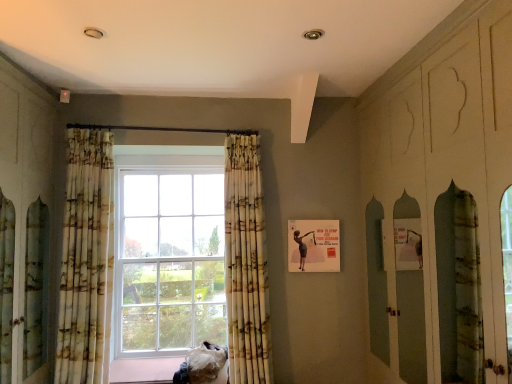
Question: Which direction should I rotate to look at printed fabric curtain at center, marked as the 2th curtain in a left-to-right arrangement?

Choices:
 (A) left
 (B) right

Answer: (A)

Question: Is printed fabric curtain at center, which is the first curtain in right-to-left order, aimed at fuzzy fabric cat at lower center?

Choices:
 (A) yes
 (B) no

Answer: (B)

Question: Is the depth of printed fabric curtain at center, which is the first curtain in right-to-left order, less than that of fuzzy fabric cat at lower center?

Choices:
 (A) yes
 (B) no

Answer: (A)

Question: Is printed fabric curtain at center, which is the first curtain in right-to-left order, not close to fuzzy fabric cat at lower center?

Choices:
 (A) no
 (B) yes

Answer: (A)

Question: From a real-world perspective, is printed fabric curtain at center, marked as the 2th curtain in a left-to-right arrangement, under fuzzy fabric cat at lower center?

Choices:
 (A) yes
 (B) no

Answer: (B)

Question: From a real-world perspective, is printed fabric curtain at center, marked as the 2th curtain in a left-to-right arrangement, over fuzzy fabric cat at lower center?

Choices:
 (A) yes
 (B) no

Answer: (A)

Question: Would you say printed fabric curtain at center, which is the first curtain in right-to-left order, contains fuzzy fabric cat at lower center?

Choices:
 (A) yes
 (B) no

Answer: (B)

Question: From a real-world perspective, is fuzzy fabric cat at lower center located higher than printed fabric curtain at left, the 2th curtain in the right-to-left sequence?

Choices:
 (A) no
 (B) yes

Answer: (A)

Question: Does fuzzy fabric cat at lower center appear on the left side of printed fabric curtain at left, the 2th curtain in the right-to-left sequence?

Choices:
 (A) no
 (B) yes

Answer: (A)

Question: From the image's perspective, is fuzzy fabric cat at lower center located beneath printed fabric curtain at left, which is the first curtain in left-to-right order?

Choices:
 (A) yes
 (B) no

Answer: (A)

Question: Is fuzzy fabric cat at lower center looking in the opposite direction of printed fabric curtain at left, which is the first curtain in left-to-right order?

Choices:
 (A) yes
 (B) no

Answer: (B)

Question: Is fuzzy fabric cat at lower center at the right side of printed fabric curtain at left, which is the first curtain in left-to-right order?

Choices:
 (A) no
 (B) yes

Answer: (B)

Question: From a real-world perspective, does fuzzy fabric cat at lower center sit lower than printed fabric curtain at left, the 2th curtain in the right-to-left sequence?

Choices:
 (A) yes
 (B) no

Answer: (A)

Question: Is the position of fuzzy fabric cat at lower center less distant than that of printed fabric curtain at center, which is the first curtain in right-to-left order?

Choices:
 (A) no
 (B) yes

Answer: (A)